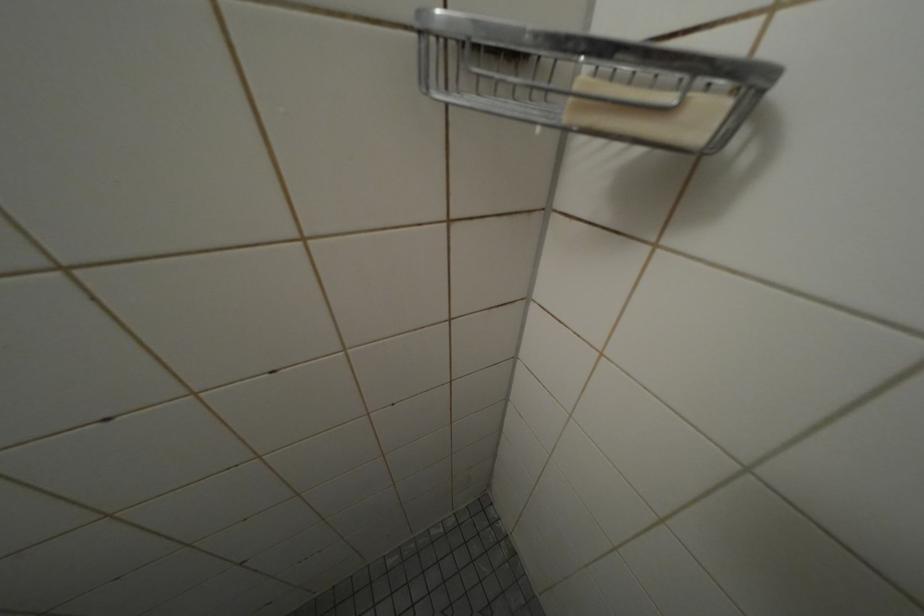
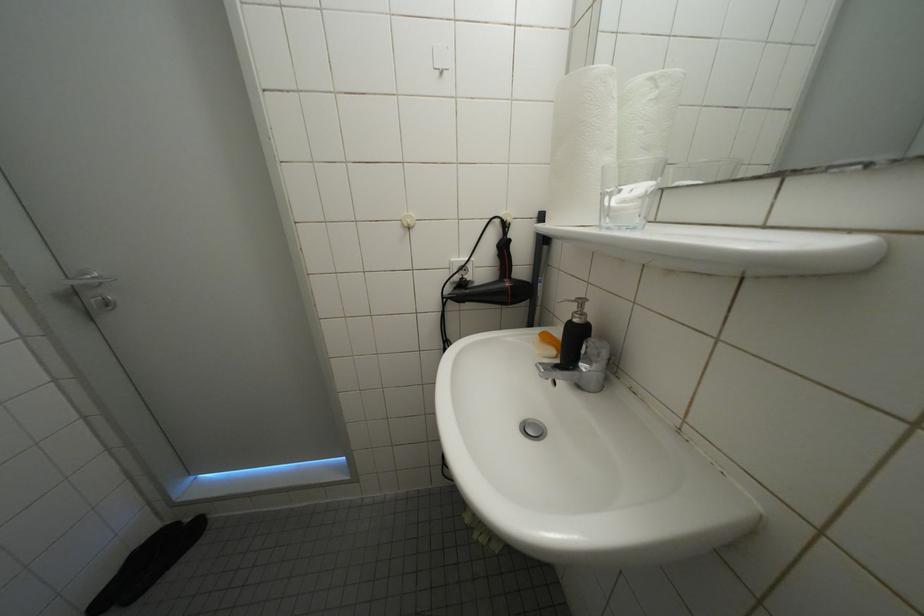
The first image is from the beginning of the video and the second image is from the end. How did the camera likely rotate when shooting the video?

The camera's rotation is toward left-down.